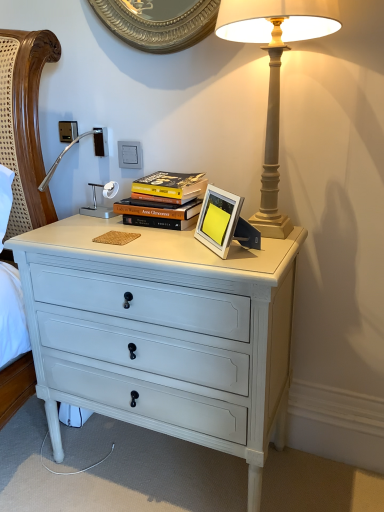
Locate an element on the screen. Image resolution: width=384 pixels, height=512 pixels. free space above white painted wood chest of drawers at center (from a real-world perspective) is located at coordinates (144, 232).